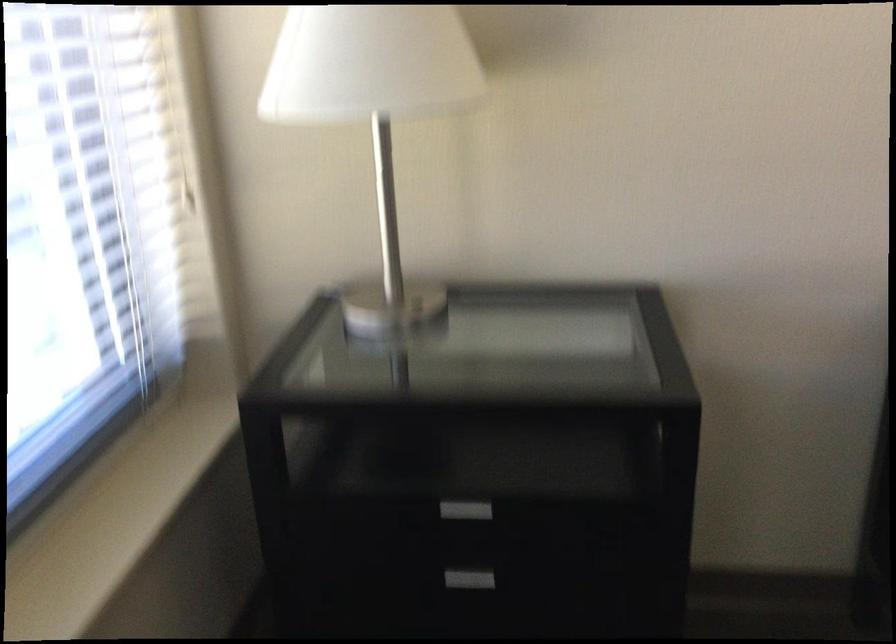
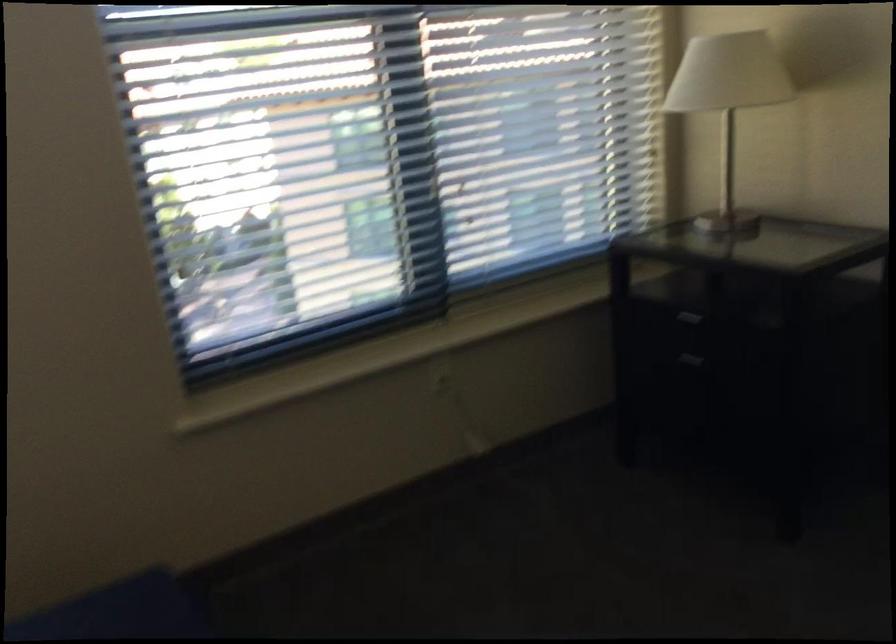
Where in the second image is the point corresponding to (446,536) from the first image?

(685, 366)